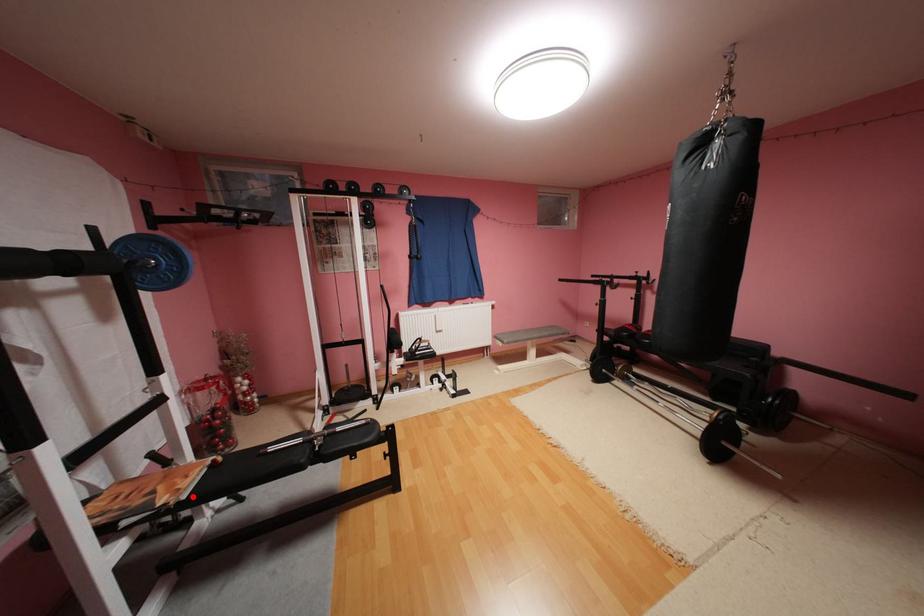
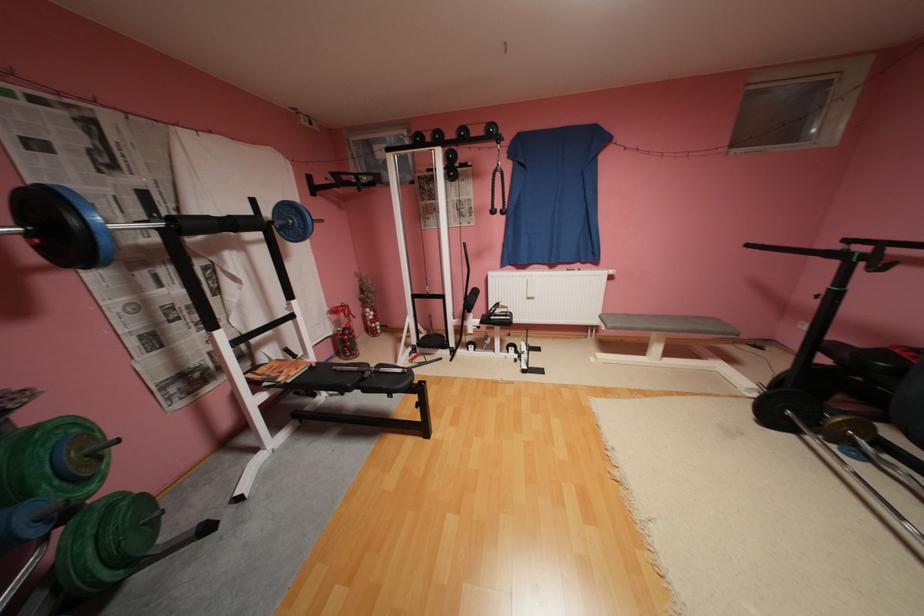
Where in the second image is the point corresponding to the highlighted location from the first image?

(298, 381)